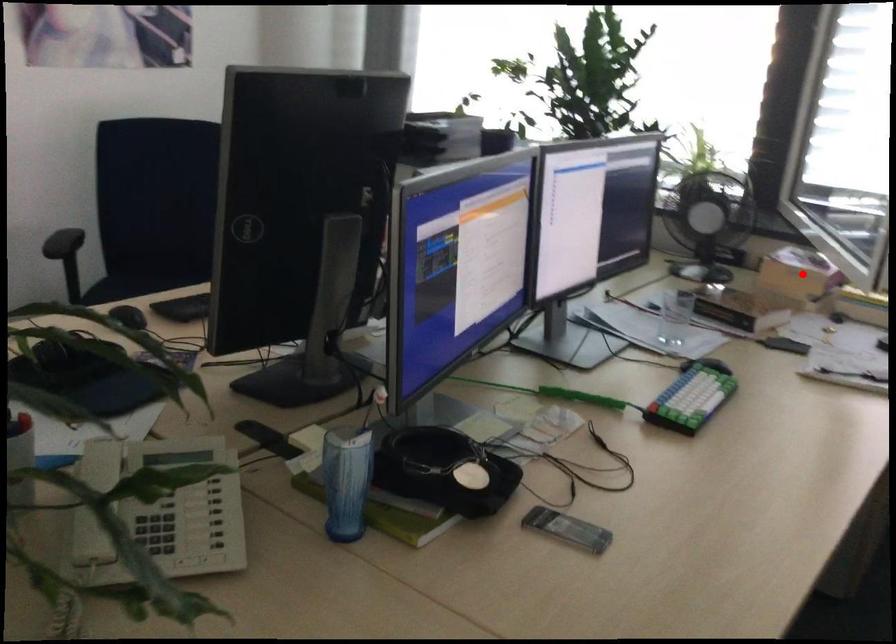
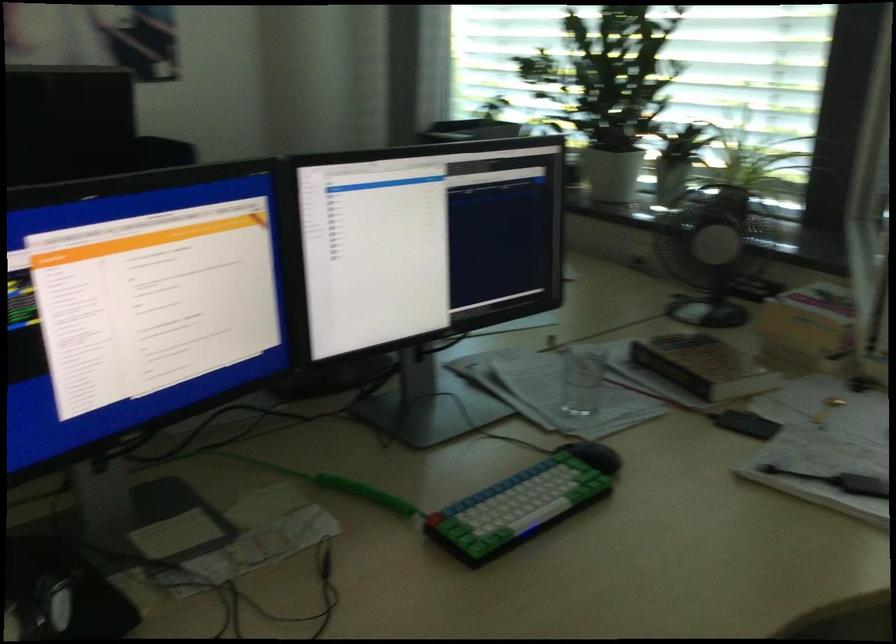
Question: I am providing you with two images of the same scene from different viewpoints. Image1 has a red point marked. In image2, the corresponding 3D location appears at what relative position? Reply with the corresponding letter.

Choices:
 (A) Closer
 (B) Farther

Answer: (A)